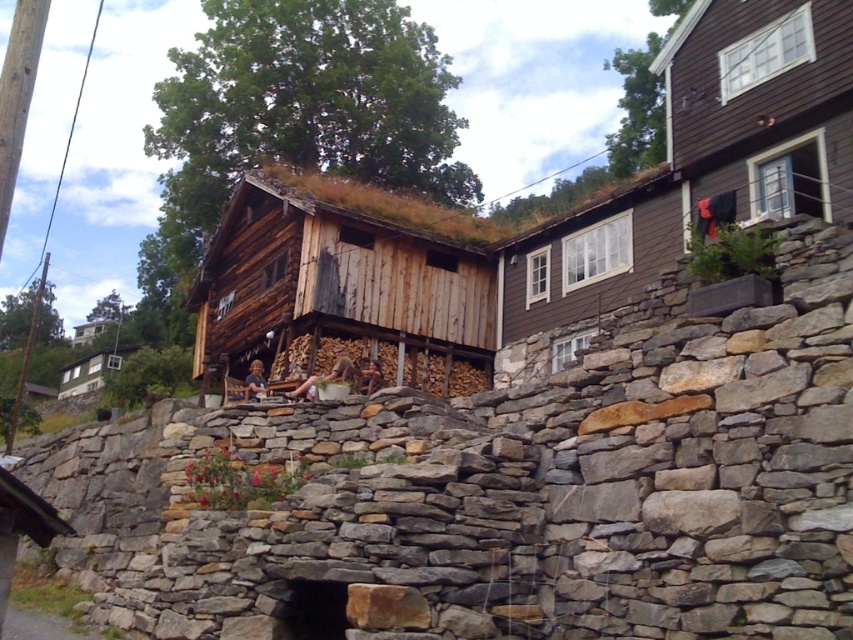
Image resolution: width=853 pixels, height=640 pixels. In order to click on gray stone wall at center in this screenshot , I will do `click(508, 492)`.

Does gray stone wall at center have a greater width compared to weathered wood hut at center?

Yes, gray stone wall at center is wider than weathered wood hut at center.

Who is more distant from viewer, (395, 598) or (451, 230)?

Point (451, 230)

Where is `gray stone wall at center`? The width and height of the screenshot is (853, 640). gray stone wall at center is located at coordinates pos(508,492).

In the scene shown: Is gray stone wall at center bigger than wooden cabin at lower left?

Indeed, gray stone wall at center has a larger size compared to wooden cabin at lower left.

Is point (181, 468) closer to camera compared to point (77, 364)?

That is True.

Image resolution: width=853 pixels, height=640 pixels. In order to click on gray stone wall at center in this screenshot , I will do `click(508, 492)`.

Who is higher up, weathered wood hut at center or wooden cabin at lower left?

weathered wood hut at center is higher up.

Between point (236, 221) and point (86, 371), which one is positioned behind?

Positioned behind is point (86, 371).

Is point (389, 253) positioned behind point (103, 369)?

No, (389, 253) is closer to viewer.

Find the location of `weathered wood hut at center`. weathered wood hut at center is located at coordinates (345, 284).